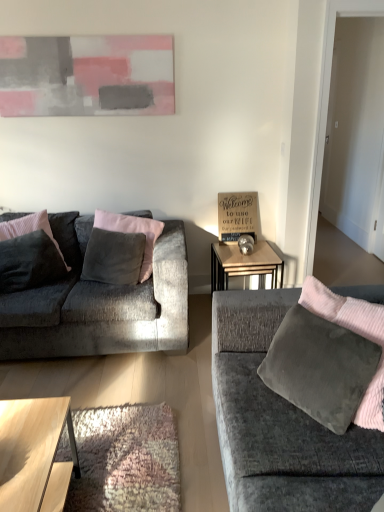
Question: From the image's perspective, is velvet dark gray pillow at left, the 1th pillow in the left-to-right sequence, positioned above or below velvet gray pillow at center, the first pillow in the right-to-left sequence?

Choices:
 (A) above
 (B) below

Answer: (B)

Question: In the image, is velvet dark gray pillow at left, the 1th pillow in the left-to-right sequence, positioned in front of or behind velvet gray pillow at center, the first pillow in the right-to-left sequence?

Choices:
 (A) behind
 (B) front

Answer: (B)

Question: Which is nearer to the velvet gray couch at right, which ranks as the second studio couch in back-to-front order?

Choices:
 (A) light brown wooden coffee table at lower left
 (B) velvet dark gray pillow at left, which is counted as the second pillow, starting from the right
 (C) velvet gray pillow at center, the first pillow in the right-to-left sequence
 (D) velvet grey couch at left, which is the 2th studio couch from front to back
 (E) abstract painting at upper center

Answer: (A)

Question: Which object is positioned farthest from the metallic silver table at center?

Choices:
 (A) velvet dark gray pillow at left, the 1th pillow in the left-to-right sequence
 (B) velvet grey couch at left, arranged as the second studio couch when viewed from the right
 (C) velvet gray couch at right, which ranks as the second studio couch in back-to-front order
 (D) abstract painting at upper center
 (E) velvet gray pillow at center, which is the 2th pillow from left to right

Answer: (D)